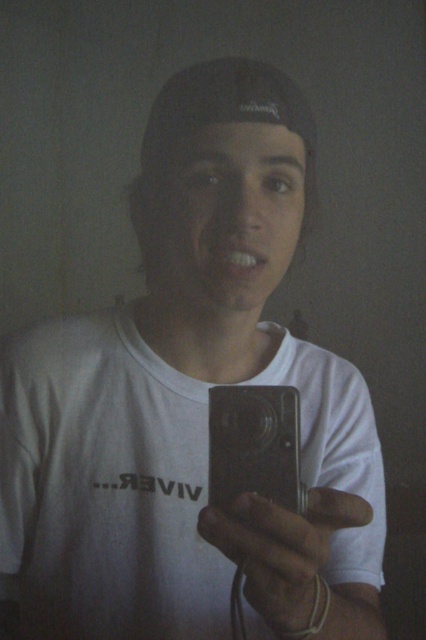
Is matte gray phone at center smaller than satin silver camera at center?

Actually, matte gray phone at center might be larger than satin silver camera at center.

Which is behind, point (313, 524) or point (282, 490)?

The point (282, 490) is more distant.

Measure the distance between point (325, 550) and camera.

Point (325, 550) and camera are 17.36 inches apart from each other.

Find the location of a particular element. The image size is (426, 640). matte gray phone at center is located at coordinates (282, 550).